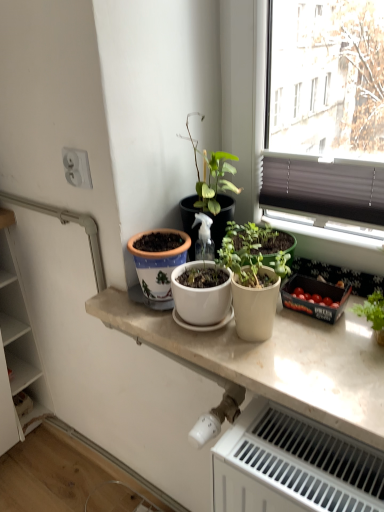
Find the location of a particular element. Image resolution: width=384 pixels, height=512 pixels. free spot in front of matte white pot at center is located at coordinates (293, 373).